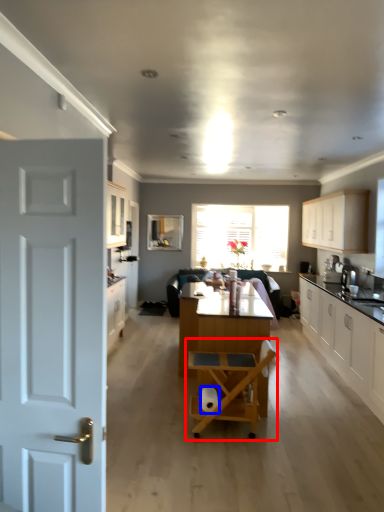
Question: Which point is closer to the camera, chair (highlighted by a red box) or toilet paper (highlighted by a blue box)?

Choices:
 (A) chair
 (B) toilet paper

Answer: (A)